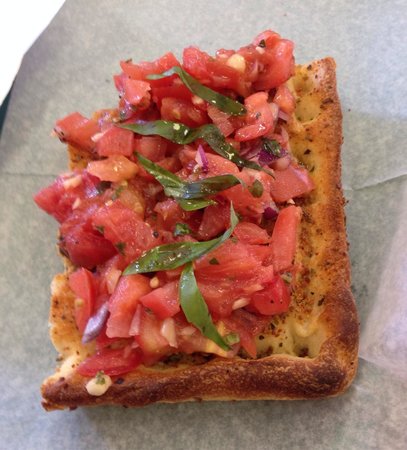
In order to click on gray corner in this screenshot , I will do `click(4, 436)`.